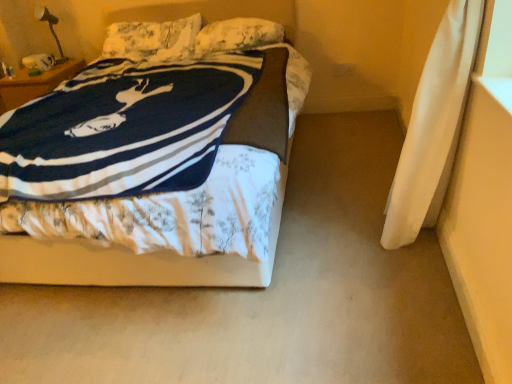
At what (x,y) coordinates should I click in order to perform the action: click on white floral fabric bed at center. Please return your answer as a coordinate pair (x, y). Image resolution: width=512 pixels, height=384 pixels. Looking at the image, I should click on (132, 263).

What do you see at coordinates (152, 39) in the screenshot? The width and height of the screenshot is (512, 384). I see `fluffy white pillow at upper center, arranged as the first pillow when viewed from the left` at bounding box center [152, 39].

Find the location of a particular element. fluffy white pillow at upper center, the 1th pillow when ordered from right to left is located at coordinates (238, 35).

I want to click on pillow that is below the fluffy white pillow at upper center, arranged as the first pillow when viewed from the left (from the image's perspective), so click(x=238, y=35).

Between fluffy white pillow at upper center, the 1th pillow when ordered from right to left, and fluffy white pillow at upper center, arranged as the first pillow when viewed from the left, which one has less height?

fluffy white pillow at upper center, the 1th pillow when ordered from right to left, is shorter.

Is fluffy white pillow at upper center, which is the second pillow from left to right, not near fluffy white pillow at upper center, arranged as the first pillow when viewed from the left?

They are positioned close to each other.

Considering the positions of point (262, 20) and point (150, 30), is point (262, 20) closer or farther from the camera than point (150, 30)?

Point (262, 20).

Considering the points (122, 13) and (182, 43), which point is in front, point (122, 13) or point (182, 43)?

The point (182, 43) is more forward.

Which is behind, white floral fabric bed at center or fluffy white pillow at upper center, arranged as the 2th pillow when viewed from the right?

fluffy white pillow at upper center, arranged as the 2th pillow when viewed from the right.

From the image's perspective, who appears lower, white floral fabric bed at center or fluffy white pillow at upper center, arranged as the 2th pillow when viewed from the right?

white floral fabric bed at center appears lower in the image.

Based on their positions, is white floral fabric bed at center located to the left or right of fluffy white pillow at upper center, arranged as the first pillow when viewed from the left?

Clearly, white floral fabric bed at center is on the right of fluffy white pillow at upper center, arranged as the first pillow when viewed from the left, in the image.

Is fluffy white pillow at upper center, arranged as the 2th pillow when viewed from the right, bigger or smaller than fluffy white pillow at upper center, which is the second pillow from left to right?

Considering their sizes, fluffy white pillow at upper center, arranged as the 2th pillow when viewed from the right, takes up more space than fluffy white pillow at upper center, which is the second pillow from left to right.

Considering the relative positions of fluffy white pillow at upper center, arranged as the 2th pillow when viewed from the right, and fluffy white pillow at upper center, which is the second pillow from left to right, in the image provided, is fluffy white pillow at upper center, arranged as the 2th pillow when viewed from the right, to the left of fluffy white pillow at upper center, which is the second pillow from left to right, from the viewer's perspective?

Correct, you'll find fluffy white pillow at upper center, arranged as the 2th pillow when viewed from the right, to the left of fluffy white pillow at upper center, which is the second pillow from left to right.

Which object is further away from the camera taking this photo, fluffy white pillow at upper center, arranged as the first pillow when viewed from the left, or fluffy white pillow at upper center, which is the second pillow from left to right?

fluffy white pillow at upper center, arranged as the first pillow when viewed from the left, is more distant.

Is point (194, 44) farther from camera compared to point (231, 45)?

Yes, point (194, 44) is behind point (231, 45).

Could you tell me if white floral fabric bed at center is turned towards fluffy white pillow at upper center, the 1th pillow when ordered from right to left?

No, white floral fabric bed at center is not turned towards fluffy white pillow at upper center, the 1th pillow when ordered from right to left.

Relative to fluffy white pillow at upper center, which is the second pillow from left to right, is white floral fabric bed at center in front or behind?

white floral fabric bed at center is positioned closer to the viewer than fluffy white pillow at upper center, which is the second pillow from left to right.

Considering the positions of point (220, 270) and point (238, 25), is point (220, 270) closer or farther from the camera than point (238, 25)?

Point (220, 270) appears to be closer to the viewer than point (238, 25).

Looking at their sizes, would you say white floral fabric bed at center is wider or thinner than fluffy white pillow at upper center, which is the second pillow from left to right?

Clearly, white floral fabric bed at center has more width compared to fluffy white pillow at upper center, which is the second pillow from left to right.

In the image, is fluffy white pillow at upper center, the 1th pillow when ordered from right to left, positioned in front of or behind white floral fabric bed at center?

Clearly, fluffy white pillow at upper center, the 1th pillow when ordered from right to left, is behind white floral fabric bed at center.

Considering the sizes of objects fluffy white pillow at upper center, the 1th pillow when ordered from right to left, and white floral fabric bed at center in the image provided, who is smaller, fluffy white pillow at upper center, the 1th pillow when ordered from right to left, or white floral fabric bed at center?

With smaller size is fluffy white pillow at upper center, the 1th pillow when ordered from right to left.

From the image's perspective, is fluffy white pillow at upper center, which is the second pillow from left to right, positioned above or below white floral fabric bed at center?

fluffy white pillow at upper center, which is the second pillow from left to right, is above white floral fabric bed at center.

Can you confirm if fluffy white pillow at upper center, which is the second pillow from left to right, is taller than white floral fabric bed at center?

Incorrect, the height of fluffy white pillow at upper center, which is the second pillow from left to right, is not larger of that of white floral fabric bed at center.

From a real-world perspective, is fluffy white pillow at upper center, arranged as the 2th pillow when viewed from the right, beneath white floral fabric bed at center?

No, from a real-world perspective, fluffy white pillow at upper center, arranged as the 2th pillow when viewed from the right, is not beneath white floral fabric bed at center.

Considering the relative sizes of fluffy white pillow at upper center, arranged as the first pillow when viewed from the left, and white floral fabric bed at center in the image provided, is fluffy white pillow at upper center, arranged as the first pillow when viewed from the left, smaller than white floral fabric bed at center?

Yes.

Would you consider fluffy white pillow at upper center, arranged as the first pillow when viewed from the left, to be distant from white floral fabric bed at center?

Yes, fluffy white pillow at upper center, arranged as the first pillow when viewed from the left, is far from white floral fabric bed at center.

In the image, is fluffy white pillow at upper center, arranged as the first pillow when viewed from the left, positioned in front of or behind white floral fabric bed at center?

fluffy white pillow at upper center, arranged as the first pillow when viewed from the left, is behind white floral fabric bed at center.

At what (x,y) coordinates should I click in order to perform the action: click on pillow below the fluffy white pillow at upper center, arranged as the first pillow when viewed from the left (from the image's perspective). Please return your answer as a coordinate pair (x, y). Looking at the image, I should click on (238, 35).

Find the location of a particular element. The image size is (512, 384). the 2nd pillow behind the white floral fabric bed at center, counting from the anchor's position is located at coordinates (152, 39).

When comparing their distances from fluffy white pillow at upper center, the 1th pillow when ordered from right to left, does fluffy white pillow at upper center, arranged as the first pillow when viewed from the left, or white floral fabric bed at center seem further?

white floral fabric bed at center.

Considering their positions, is white floral fabric bed at center positioned further to fluffy white pillow at upper center, which is the second pillow from left to right, than fluffy white pillow at upper center, arranged as the first pillow when viewed from the left?

The object further to fluffy white pillow at upper center, which is the second pillow from left to right, is white floral fabric bed at center.

When comparing their distances from white floral fabric bed at center, does fluffy white pillow at upper center, arranged as the 2th pillow when viewed from the right, or fluffy white pillow at upper center, the 1th pillow when ordered from right to left, seem closer?

Among the two, fluffy white pillow at upper center, the 1th pillow when ordered from right to left, is located nearer to white floral fabric bed at center.

Based on the photo, which object lies further to the anchor point fluffy white pillow at upper center, arranged as the first pillow when viewed from the left, fluffy white pillow at upper center, which is the second pillow from left to right, or white floral fabric bed at center?

white floral fabric bed at center is positioned further to the anchor fluffy white pillow at upper center, arranged as the first pillow when viewed from the left.

When comparing their distances from white floral fabric bed at center, does fluffy white pillow at upper center, which is the second pillow from left to right, or fluffy white pillow at upper center, arranged as the first pillow when viewed from the left, seem further?

Among the two, fluffy white pillow at upper center, arranged as the first pillow when viewed from the left, is located further to white floral fabric bed at center.

Considering their positions, is white floral fabric bed at center positioned further to fluffy white pillow at upper center, arranged as the 2th pillow when viewed from the right, than fluffy white pillow at upper center, which is the second pillow from left to right?

white floral fabric bed at center is positioned further to the anchor fluffy white pillow at upper center, arranged as the 2th pillow when viewed from the right.

Where is `pillow located between white floral fabric bed at center and fluffy white pillow at upper center, arranged as the first pillow when viewed from the left, in the depth direction`? The width and height of the screenshot is (512, 384). pillow located between white floral fabric bed at center and fluffy white pillow at upper center, arranged as the first pillow when viewed from the left, in the depth direction is located at coordinates (238, 35).